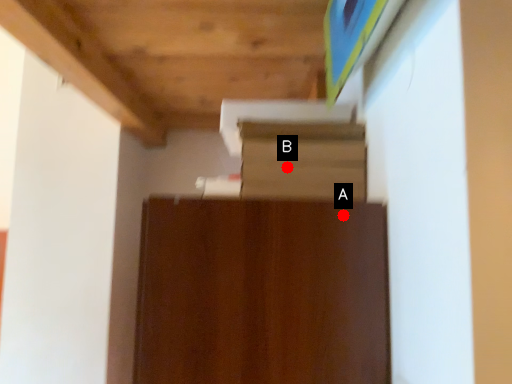
Question: Two points are circled on the image, labeled by A and B beside each circle. Which point is further to the camera?

Choices:
 (A) A is further
 (B) B is further

Answer: (B)